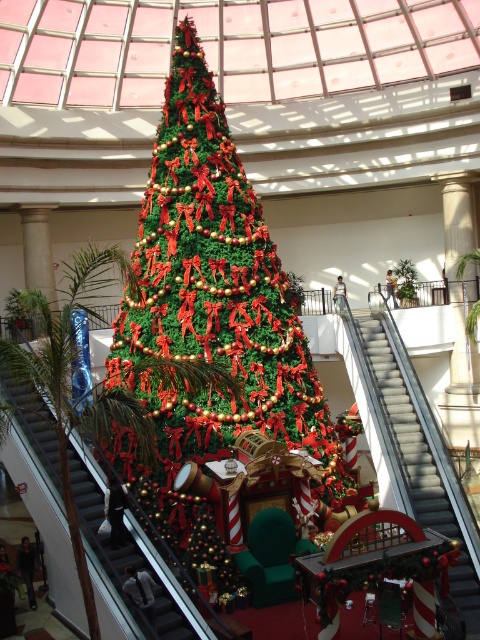
You are standing at the base of the Christmas tree in the mall and see two points marked in the scene. One is at coordinate point (470, 580) and the other is at point (99, 557). Which point is closer to you?

Point (99, 557) is closer to you because it is less far from the camera than point (470, 580).

You are a parent holding a toddler who wants to ride the escalators. You are standing near the Christmas tree and need to choose between the metallic gray escalator at center and the metallic silver escalator at left. Which escalator should you choose if you want to avoid the one with a smaller step size?

The metallic gray escalator at center has a larger size compared to the metallic silver escalator at left, so you should choose the metallic gray escalator at center because larger escalators typically have bigger steps which are safer for toddlers.

You are a holiday shopper standing in front of the Christmas tree. You need to exit the mall through the nearest escalator. Which escalator should you use, the metallic gray escalator at center or the metallic silver escalator at left?

The metallic gray escalator at center is to the right of the metallic silver escalator at left. Since you are standing in front of the Christmas tree, the metallic gray escalator at center is closer to you and would be the nearest one to exit through.